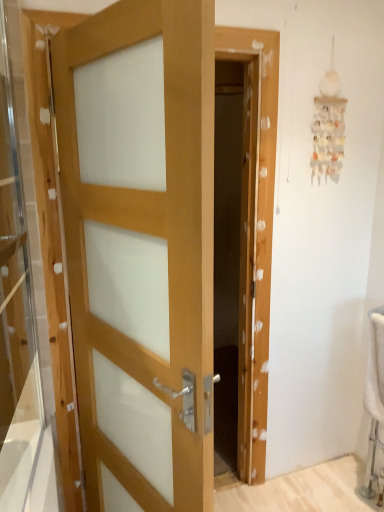
Question: Is point (44, 478) closer or farther from the camera than point (145, 29)?

Choices:
 (A) closer
 (B) farther

Answer: (B)

Question: Based on their positions, is transparent glass door at left located to the left or right of light wood door at center?

Choices:
 (A) right
 (B) left

Answer: (B)

Question: In terms of height, does transparent glass door at left look taller or shorter compared to light wood door at center?

Choices:
 (A) tall
 (B) short

Answer: (B)

Question: Considering the positions of point (130, 117) and point (14, 10), is point (130, 117) closer or farther from the camera than point (14, 10)?

Choices:
 (A) closer
 (B) farther

Answer: (A)

Question: From the image's perspective, is light wood door at center above or below transparent glass door at left?

Choices:
 (A) below
 (B) above

Answer: (A)

Question: Considering the relative positions of light wood door at center and transparent glass door at left in the image provided, is light wood door at center to the left or to the right of transparent glass door at left?

Choices:
 (A) right
 (B) left

Answer: (A)

Question: Considering the positions of light wood door at center and transparent glass door at left in the image, is light wood door at center taller or shorter than transparent glass door at left?

Choices:
 (A) tall
 (B) short

Answer: (A)